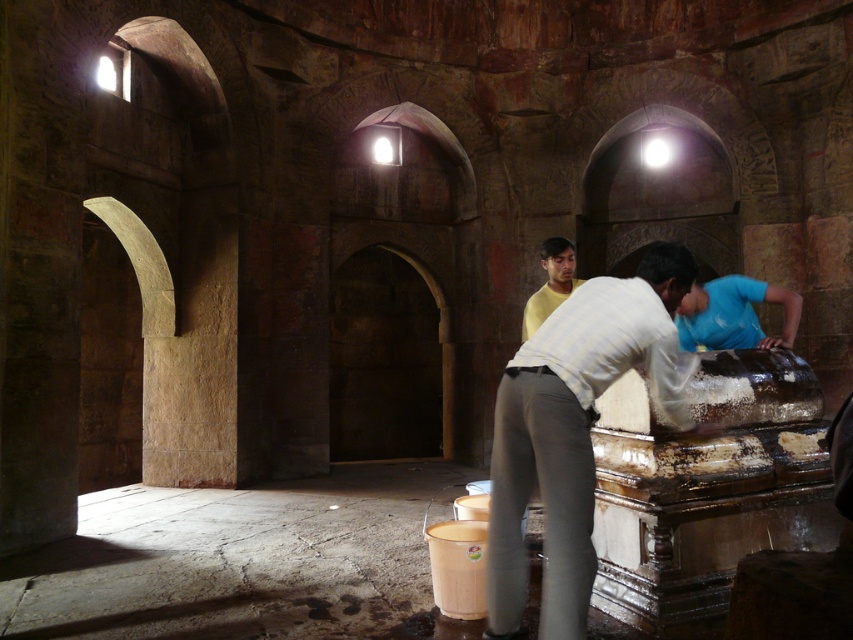
Question: Considering the real-world distances, which object is closest to the white matte shirt at center?

Choices:
 (A) blue cotton shirt at lower right
 (B) yellow matte shirt at center

Answer: (A)

Question: Does white matte shirt at center come in front of yellow matte shirt at center?

Choices:
 (A) yes
 (B) no

Answer: (A)

Question: Which of the following is the farthest from the observer?

Choices:
 (A) (660, 396)
 (B) (563, 285)
 (C) (714, 340)

Answer: (B)

Question: In this image, where is white matte shirt at center located relative to yellow matte shirt at center?

Choices:
 (A) above
 (B) below

Answer: (B)

Question: Is white matte shirt at center to the right of blue cotton shirt at lower right from the viewer's perspective?

Choices:
 (A) yes
 (B) no

Answer: (B)

Question: Which point is farther from the camera taking this photo?

Choices:
 (A) (785, 328)
 (B) (488, 596)
 (C) (550, 280)

Answer: (C)